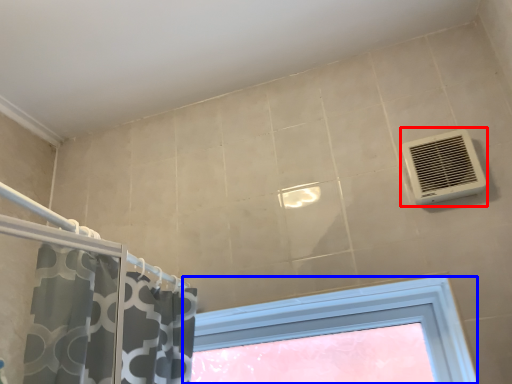
Question: Which of the following is the closest to the observer, air conditioning (highlighted by a red box) or window (highlighted by a blue box)?

Choices:
 (A) air conditioning
 (B) window

Answer: (A)